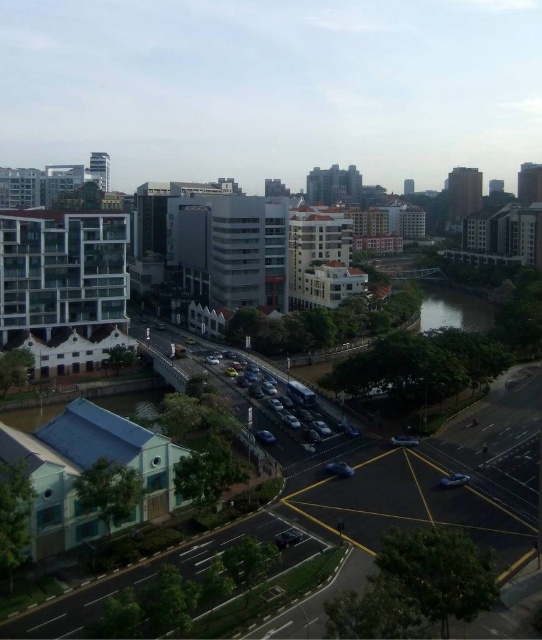
You are a pedestrian standing at the intersection and want to cross the road to reach the small light colored building at bottom left. There are two sedans in your view, a shiny blue sedan at lower right and a metallic blue sedan at center. Which sedan is blocking your path to the building?

The shiny blue sedan at lower right is positioned under the metallic blue sedan at center, so the metallic blue sedan at center is blocking the path to the small light colored building at bottom left.

You are a pedestrian standing at the intersection and want to cross the road. There are two cars in the center of the image, a shiny black car at center and a shiny blue sedan at center. Which car should you wait for before proceeding to cross safely?

You should wait for both the shiny black car at center and the shiny blue sedan at center to pass since they are positioned in the center of the road where you would need to cross.